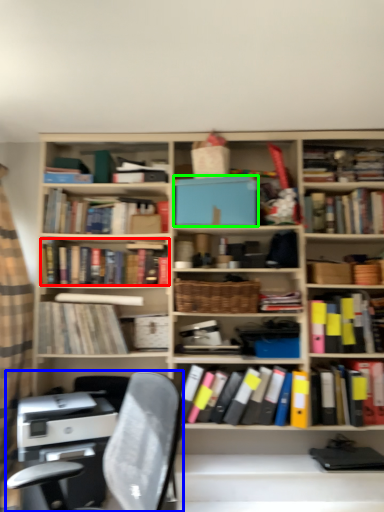
Question: Which is farther away from book (highlighted by a red box)? chair (highlighted by a blue box) or paperback book (highlighted by a green box)?

Choices:
 (A) chair
 (B) paperback book

Answer: (A)